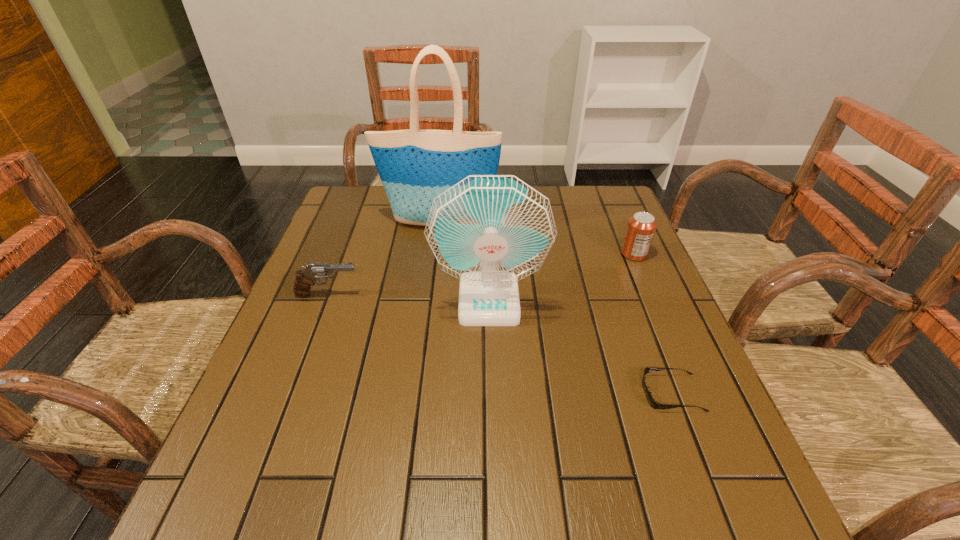
Identify the location of the farthest object. Image resolution: width=960 pixels, height=540 pixels. (415, 166).

Image resolution: width=960 pixels, height=540 pixels. What are the coordinates of `tote bag` in the screenshot? It's located at (415, 166).

At what (x,y) coordinates should I click in order to perform the action: click on fan. Please return your answer as a coordinate pair (x, y). Image resolution: width=960 pixels, height=540 pixels. Looking at the image, I should click on (490, 231).

Find the location of `the fourth nearest object`. the fourth nearest object is located at coordinates (641, 227).

What are the coordinates of `the second shortest object` in the screenshot? It's located at (305, 278).

This screenshot has height=540, width=960. Identify the location of sunglasses. (653, 403).

Locate an element on the screen. This screenshot has width=960, height=540. the shortest object is located at coordinates [x=653, y=403].

Identify the location of free spot located 0.080m on the left of the tote bag. Image resolution: width=960 pixels, height=540 pixels. (352, 223).

Where is `free space located 0.100m in front of the second tallest object to face the airflow`? The image size is (960, 540). free space located 0.100m in front of the second tallest object to face the airflow is located at coordinates (491, 363).

At what (x,y) coordinates should I click in order to perform the action: click on vacant region located on the left of the can. Please return your answer as a coordinate pair (x, y). The height and width of the screenshot is (540, 960). Looking at the image, I should click on (506, 254).